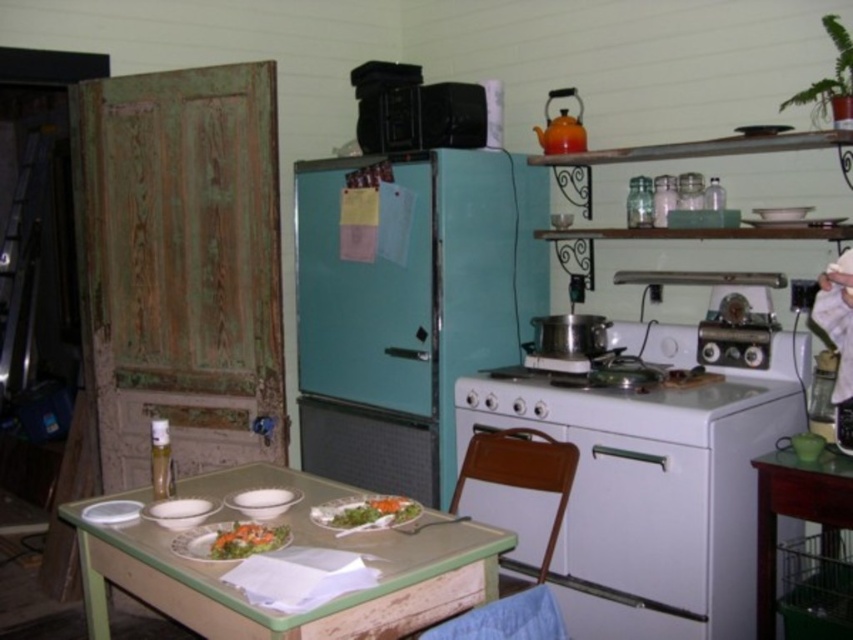
Question: Among these points, which one is nearest to the camera?

Choices:
 (A) (764, 588)
 (B) (305, 509)
 (C) (761, 275)
 (D) (250, 528)

Answer: (D)

Question: Does white glossy stove at center appear under green leafy vegetables at center?

Choices:
 (A) yes
 (B) no

Answer: (B)

Question: Estimate the real-world distances between objects in this image. Which object is closer to the green leafy vegetables at center?

Choices:
 (A) teal matte refrigerator at center
 (B) wooden table at lower right
 (C) metallic silver exhaust hood at upper center

Answer: (A)

Question: Estimate the real-world distances between objects in this image. Which object is closer to the white glossy stove at center?

Choices:
 (A) teal matte refrigerator at center
 (B) wooden table at lower right
 (C) green leafy salad at table
 (D) metallic silver exhaust hood at upper center

Answer: (B)

Question: Is white glossy stove at center thinner than teal matte refrigerator at center?

Choices:
 (A) yes
 (B) no

Answer: (B)

Question: Is teal matte refrigerator at center above green leafy vegetables at center?

Choices:
 (A) yes
 (B) no

Answer: (A)